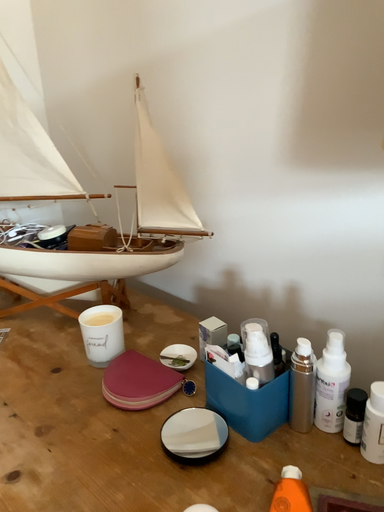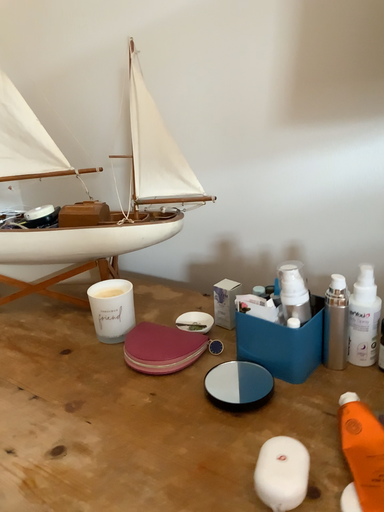
Question: Which way did the camera rotate in the video?

Choices:
 (A) rotated right
 (B) rotated left

Answer: (A)